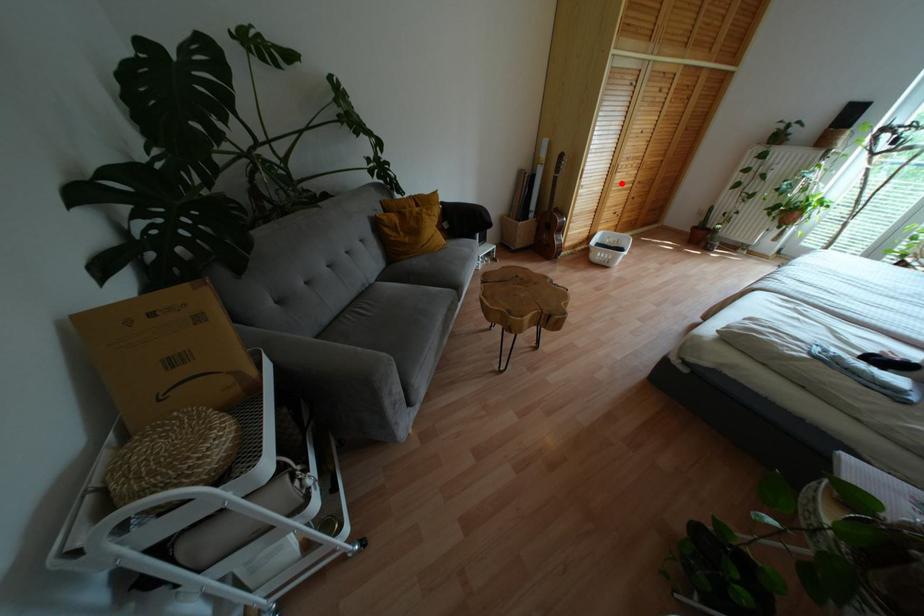
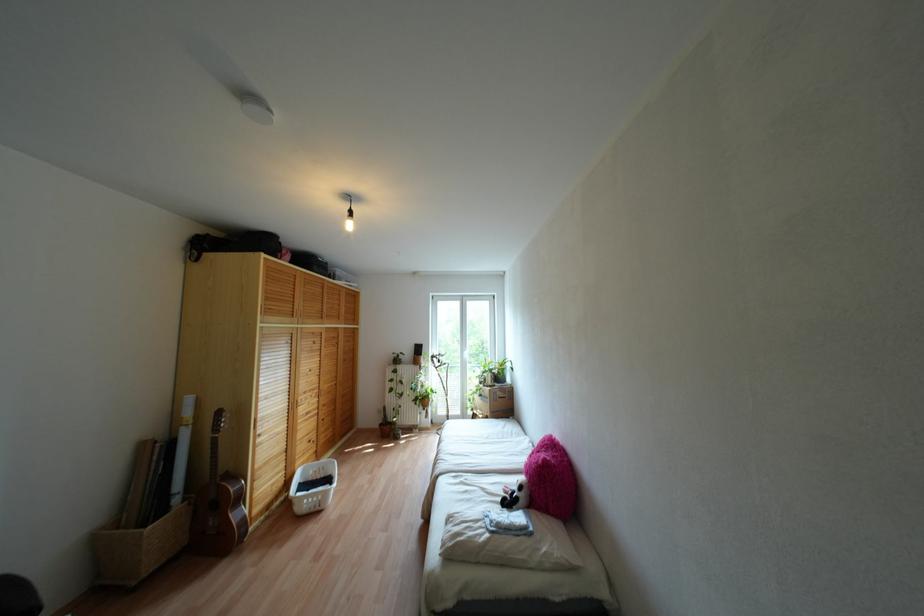
Question: I am providing you with two images of the same scene from different viewpoints. A red point is marked on the first image. At the location where the point appears in image 1, is it still visible in image 2?

Choices:
 (A) Yes
 (B) No

Answer: (A)